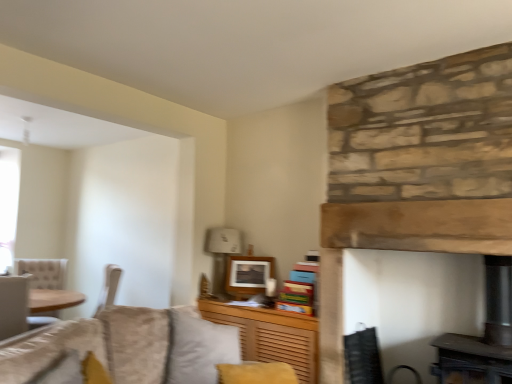
Question: Considering the relative positions of white fabric lampshade at upper center and velvet gray pillow at center in the image provided, is white fabric lampshade at upper center behind velvet gray pillow at center?

Choices:
 (A) no
 (B) yes

Answer: (B)

Question: From a real-world perspective, is white fabric lampshade at upper center physically above velvet gray pillow at center?

Choices:
 (A) no
 (B) yes

Answer: (B)

Question: Does white fabric lampshade at upper center have a larger size compared to velvet gray pillow at center?

Choices:
 (A) yes
 (B) no

Answer: (B)

Question: Is white fabric lampshade at upper center shorter than velvet gray pillow at center?

Choices:
 (A) yes
 (B) no

Answer: (A)

Question: Is white fabric lampshade at upper center facing towards velvet gray pillow at center?

Choices:
 (A) no
 (B) yes

Answer: (A)

Question: Does white fabric lampshade at upper center appear on the right side of velvet gray pillow at center?

Choices:
 (A) no
 (B) yes

Answer: (B)

Question: Does matte white picture frame at upper center have a smaller size compared to velvet gray pillow at center?

Choices:
 (A) no
 (B) yes

Answer: (B)

Question: From the image's perspective, would you say matte white picture frame at upper center is shown under velvet gray pillow at center?

Choices:
 (A) no
 (B) yes

Answer: (A)

Question: Can you confirm if matte white picture frame at upper center is positioned to the right of velvet gray pillow at center?

Choices:
 (A) no
 (B) yes

Answer: (B)

Question: Does matte white picture frame at upper center contain velvet gray pillow at center?

Choices:
 (A) yes
 (B) no

Answer: (B)

Question: Is matte white picture frame at upper center next to velvet gray pillow at center?

Choices:
 (A) no
 (B) yes

Answer: (A)

Question: Is the depth of matte white picture frame at upper center less than that of velvet gray pillow at center?

Choices:
 (A) no
 (B) yes

Answer: (A)

Question: Is velvet gray pillow at center looking in the opposite direction of matte white picture frame at upper center?

Choices:
 (A) no
 (B) yes

Answer: (A)